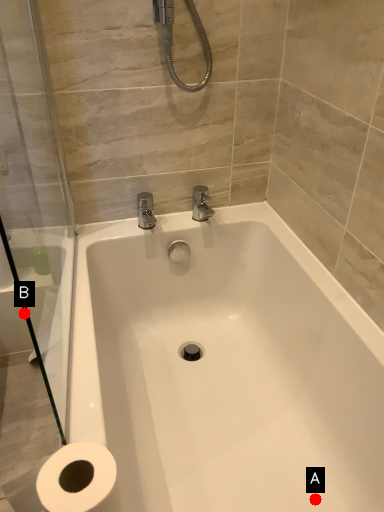
Question: Two points are circled on the image, labeled by A and B beside each circle. Which point is farther to the camera?

Choices:
 (A) A is further
 (B) B is further

Answer: (B)